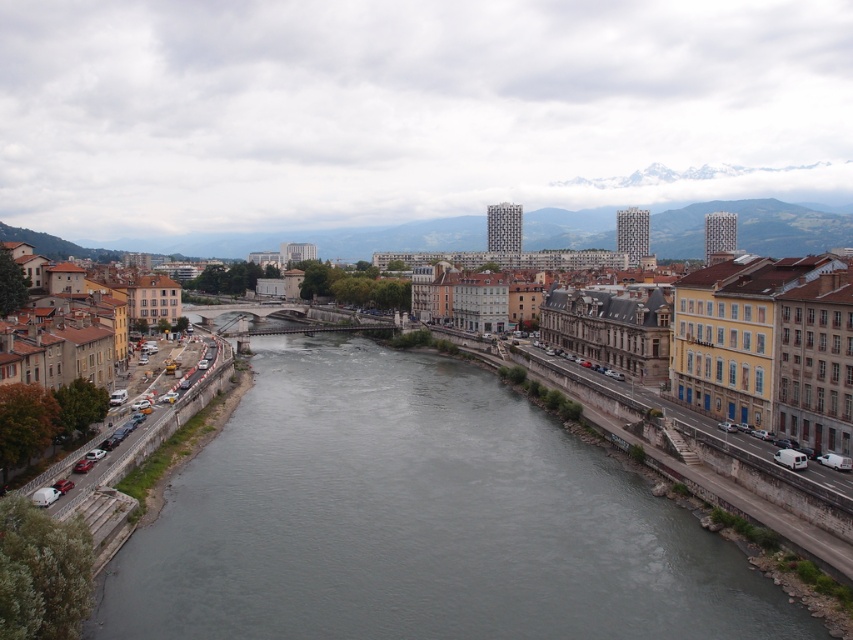
Between gray concrete waterway at lower left and concrete bridge at center, which one is positioned lower?

gray concrete waterway at lower left

Between gray concrete waterway at lower left and concrete bridge at center, which one appears on the right side from the viewer's perspective?

From the viewer's perspective, gray concrete waterway at lower left appears more on the right side.

The image size is (853, 640). What are the coordinates of `gray concrete waterway at lower left` in the screenshot? It's located at (418, 520).

Where is `gray concrete waterway at lower left`? gray concrete waterway at lower left is located at coordinates (418, 520).

Is smooth concrete bridge at center in front of concrete bridge at center?

No, smooth concrete bridge at center is further to the viewer.

Which is more to the right, smooth concrete bridge at center or concrete bridge at center?

Positioned to the right is smooth concrete bridge at center.

Identify the location of smooth concrete bridge at center. (752, 228).

Identify the location of smooth concrete bridge at center. (752, 228).

Can you confirm if gray concrete waterway at lower left is wider than smooth concrete bridge at center?

In fact, gray concrete waterway at lower left might be narrower than smooth concrete bridge at center.

Who is more forward, (567, 438) or (828, 236)?

Point (567, 438)

This screenshot has width=853, height=640. In order to click on gray concrete waterway at lower left in this screenshot , I will do `click(418, 520)`.